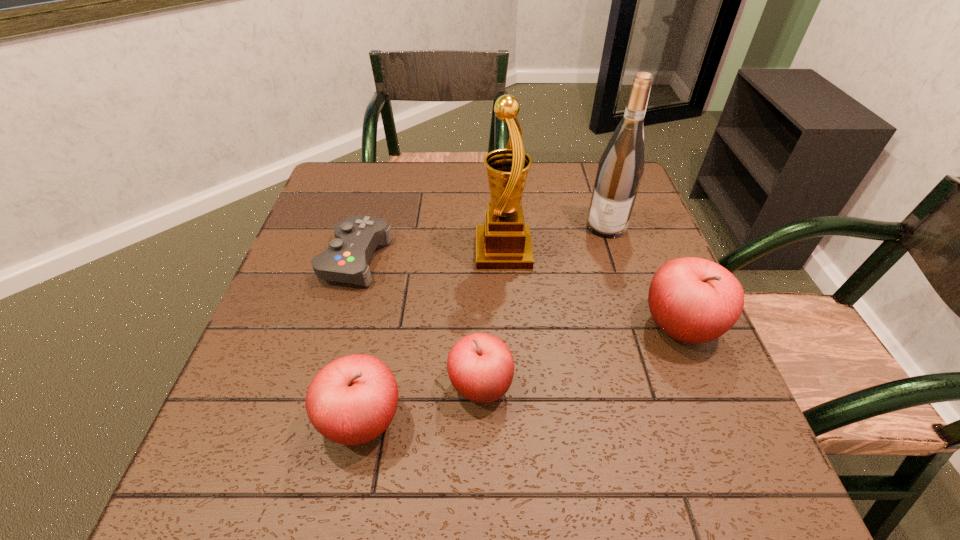
Find the location of `free point between the second shortest apple and the rightmost apple`. free point between the second shortest apple and the rightmost apple is located at coordinates (521, 374).

You are a GUI agent. You are given a task and a screenshot of the screen. Output one action in this format:
    pyautogui.click(x=<x>, y=<y>)
    Task: Click on the vacant space in between the rightmost apple and the award
    
    Given the screenshot: What is the action you would take?
    pyautogui.click(x=591, y=289)

Find the location of `unoccupied area between the leftmost apple and the second apple from left to right`. unoccupied area between the leftmost apple and the second apple from left to right is located at coordinates (421, 404).

Locate an element on the screen. free spot between the control and the second apple from right to left is located at coordinates (418, 323).

In order to click on unoccupied position between the second shortest apple and the second apple from left to right in this screenshot , I will do `click(421, 404)`.

Point out which object is positioned as the fourth nearest to the leftmost apple. Please provide its 2D coordinates. Your answer should be formatted as a tuple, i.e. [(x, y)], where the tuple contains the x and y coordinates of a point satisfying the conditions above.

[(693, 300)]

Locate which object ranks second in proximity to the second tallest apple. Please provide its 2D coordinates. Your answer should be formatted as a tuple, i.e. [(x, y)], where the tuple contains the x and y coordinates of a point satisfying the conditions above.

[(346, 260)]

I want to click on apple object that ranks as the second closest to the shortest apple, so [693, 300].

Find the location of a particular element. The width and height of the screenshot is (960, 540). apple that is the closest to the wine bottle is located at coordinates [693, 300].

Identify the location of vacant space that satisfies the following two spatial constraints: 1. on the back side of the shortest apple; 2. on the right side of the rightmost apple. This screenshot has width=960, height=540. (481, 327).